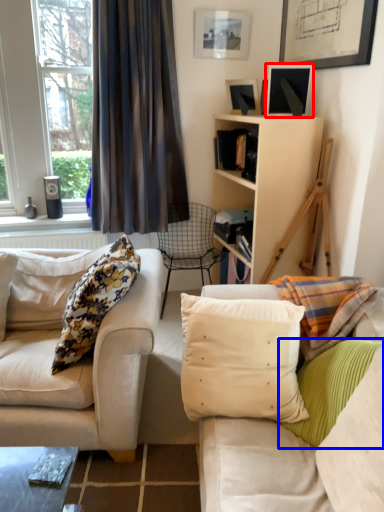
Question: Which of the following is the farthest to the observer, picture frame (highlighted by a red box) or pillow (highlighted by a blue box)?

Choices:
 (A) picture frame
 (B) pillow

Answer: (A)